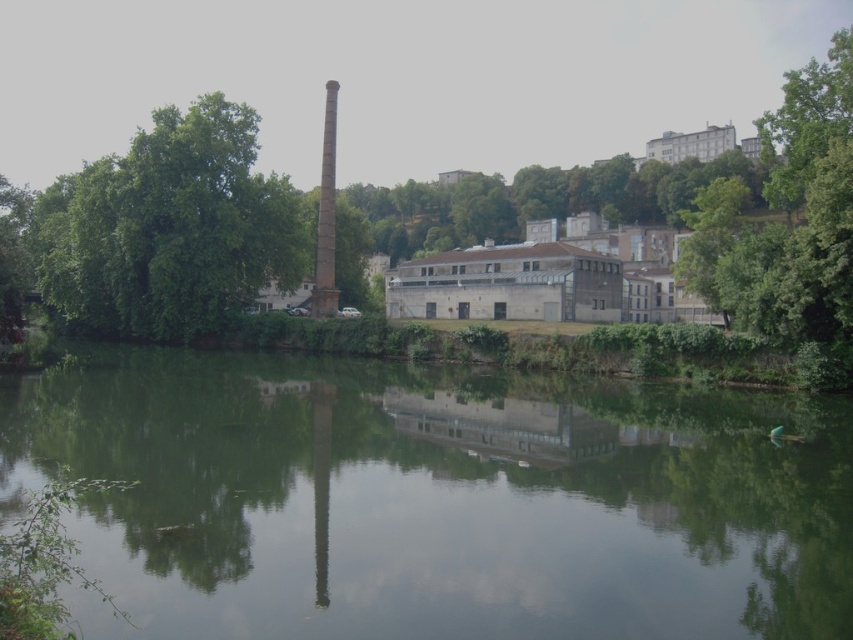
You are a bird seeking a nesting spot. You can choose between the green leafy tree at upper right and the smooth concrete chimney at center. Which option offers a more spacious area for nesting?

The green leafy tree at upper right has a larger size compared to the smooth concrete chimney at center, making it a more spacious option for nesting.

You are a drone operator planning to fly a drone from the green leafy tree at left to the green reflective water at center. The drone has a maximum flight range of 50 meters. Can the drone safely make this trip without needing to recharge?

The distance between the green leafy tree at left and the green reflective water at center is 47.02 meters, which is within the drone operator drone has a maximum flight range of 50 meters. The drone can safely make this trip without needing to recharge.